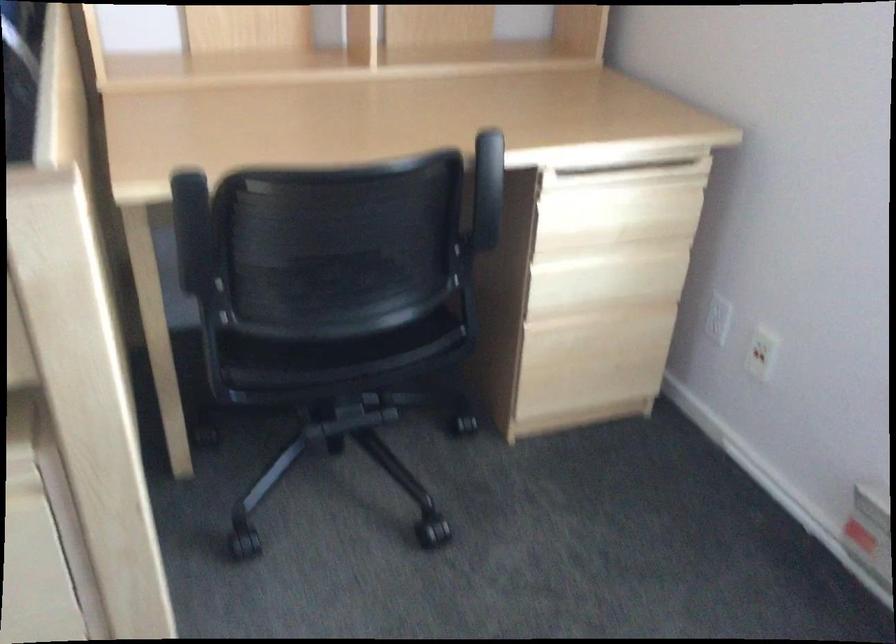
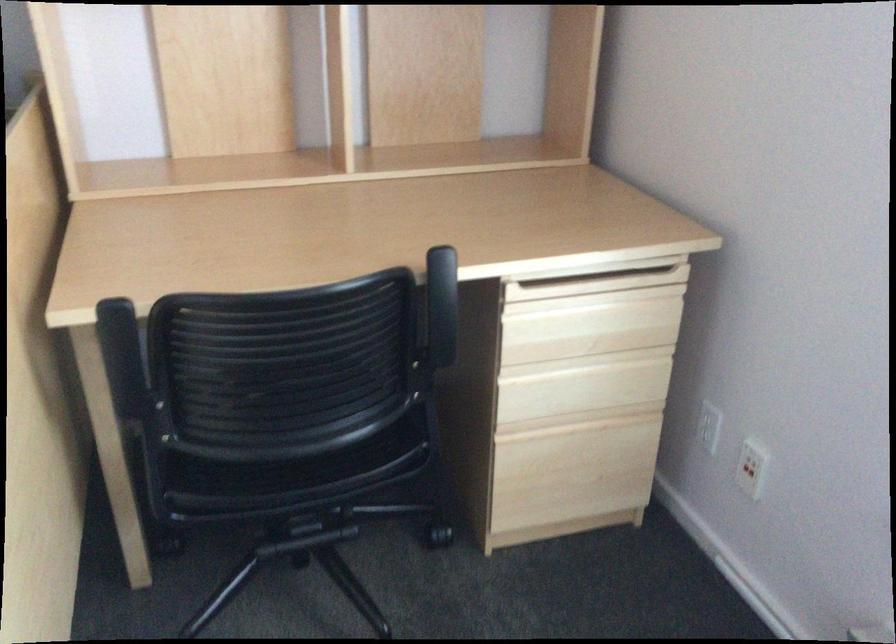
Where in the second image is the point corresponding to the point at 349,335 from the first image?

(296, 455)